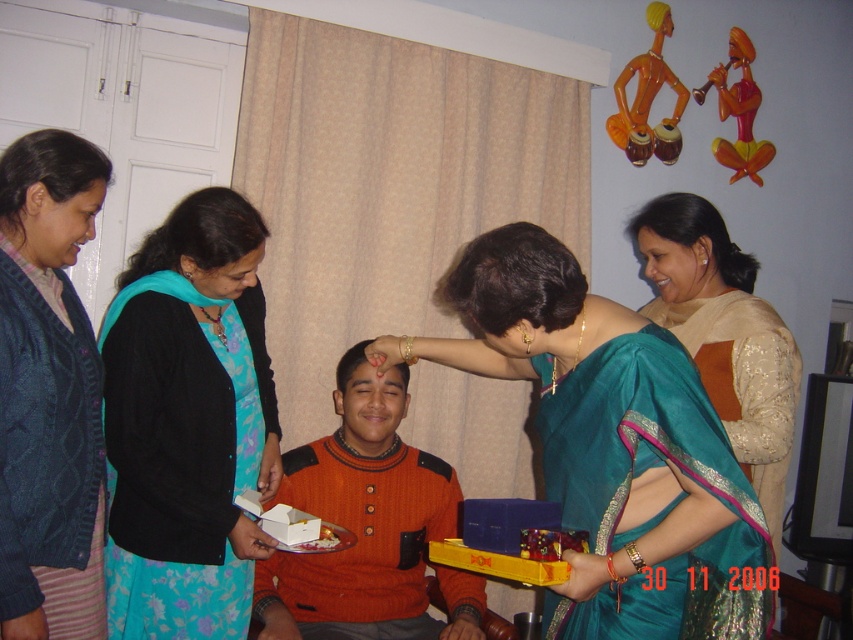
You are standing in the living room and see two points marked in the scene. Which point, point (399, 608) or point (634, 108), is closer to you?

Point (399, 608) is closer to the viewer than point (634, 108).

You are standing in the living room and see the teal silk saree at center and the yellow plastic tray at lower center. Which object is positioned higher in the scene?

The teal silk saree at center is located above the yellow plastic tray at lower center, so it is positioned higher in the scene.

You are a guest at this celebration and need to place a small offering on the yellow plastic tray at lower center. However, there is a teal silk saree at center blocking your view. Can you still reach the tray without moving the saree?

The teal silk saree at center is in front of the yellow plastic tray at lower center, so it is blocking access to the tray. You would need to move the saree to reach the tray.